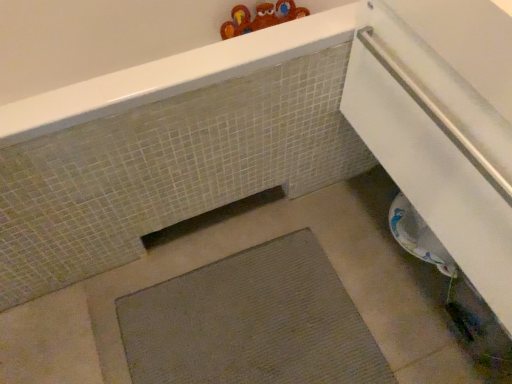
Question: Would you say matte gray mat at lower center contains white glossy towel at lower right?

Choices:
 (A) no
 (B) yes

Answer: (A)

Question: Are matte gray mat at lower center and white glossy towel at lower right located far from each other?

Choices:
 (A) no
 (B) yes

Answer: (A)

Question: From a real-world perspective, does matte gray mat at lower center sit lower than white glossy towel at lower right?

Choices:
 (A) yes
 (B) no

Answer: (A)

Question: Is matte gray mat at lower center at the right side of white glossy towel at lower right?

Choices:
 (A) yes
 (B) no

Answer: (B)

Question: From the image's perspective, is matte gray mat at lower center under white glossy towel at lower right?

Choices:
 (A) no
 (B) yes

Answer: (A)

Question: From their relative heights in the image, would you say white glossy towel at lower right is taller or shorter than gray textured bath mat at center?

Choices:
 (A) short
 (B) tall

Answer: (B)

Question: Considering the relative positions of white glossy towel at lower right and gray textured bath mat at center in the image provided, is white glossy towel at lower right to the left or to the right of gray textured bath mat at center?

Choices:
 (A) right
 (B) left

Answer: (A)

Question: Choose the correct answer: Is white glossy towel at lower right inside gray textured bath mat at center or outside it?

Choices:
 (A) outside
 (B) inside

Answer: (A)

Question: Relative to gray textured bath mat at center, is white glossy towel at lower right in front or behind?

Choices:
 (A) front
 (B) behind

Answer: (A)

Question: From the image's perspective, is matte gray mat at lower center above or below gray textured bath mat at center?

Choices:
 (A) above
 (B) below

Answer: (A)

Question: Considering the positions of matte gray mat at lower center and gray textured bath mat at center in the image, is matte gray mat at lower center bigger or smaller than gray textured bath mat at center?

Choices:
 (A) big
 (B) small

Answer: (A)

Question: Is point (304, 170) closer or farther from the camera than point (118, 319)?

Choices:
 (A) farther
 (B) closer

Answer: (A)

Question: Is matte gray mat at lower center taller or shorter than gray textured bath mat at center?

Choices:
 (A) tall
 (B) short

Answer: (A)

Question: Considering their positions, is white glossy towel at lower right located in front of or behind matte gray mat at lower center?

Choices:
 (A) behind
 (B) front

Answer: (B)

Question: From a real-world perspective, is white glossy towel at lower right physically located above or below matte gray mat at lower center?

Choices:
 (A) below
 (B) above

Answer: (B)